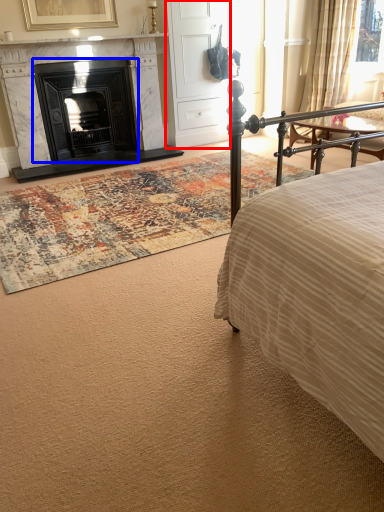
Question: Among these objects, which one is farthest to the camera, armoire (highlighted by a red box) or fireplace (highlighted by a blue box)?

Choices:
 (A) armoire
 (B) fireplace

Answer: (A)